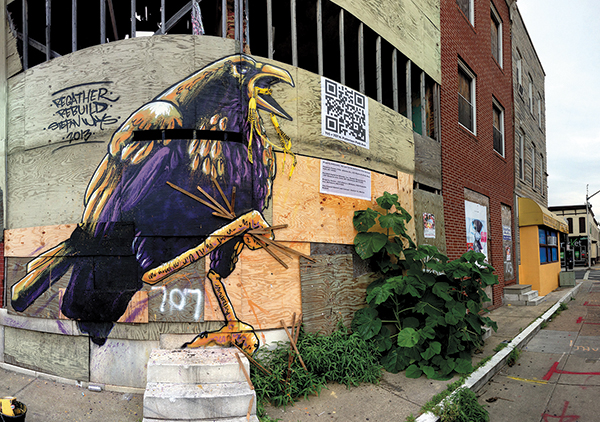
Where is `wooden slabs`? wooden slabs is located at coordinates 460,87.